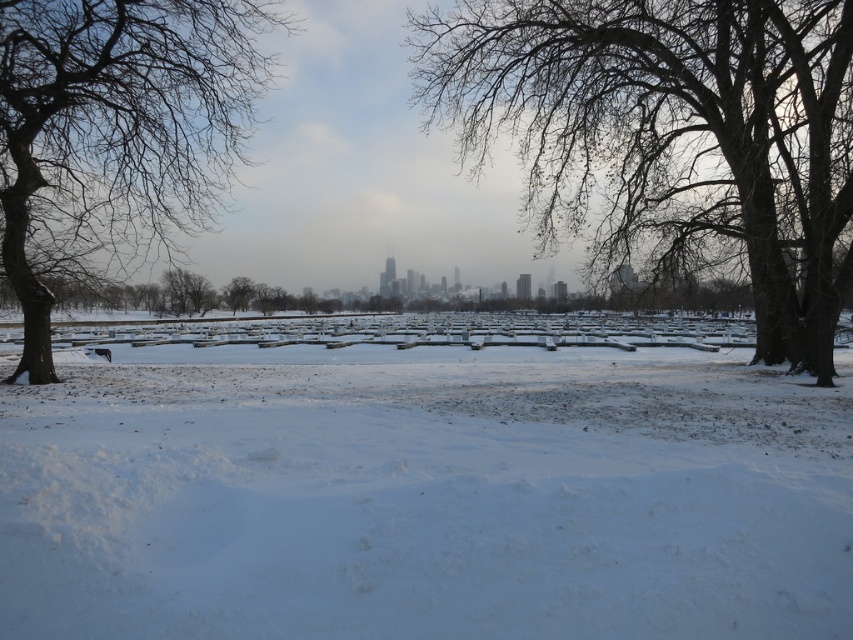
Which is above, bare wood tree at left or bare branches at center?

bare wood tree at left

Is bare wood tree at left positioned behind bare branches at center?

No.

Identify the location of bare wood tree at left. point(114,132).

You are a GUI agent. You are given a task and a screenshot of the screen. Output one action in this format:
    pyautogui.click(x=<x>, y=<y>)
    Task: Click on the bare wood tree at left
    This screenshot has height=640, width=853.
    Given the screenshot: What is the action you would take?
    pyautogui.click(x=114, y=132)

Based on the photo, which is more to the right, white fluffy snow at center or bare wood tree at center?

From the viewer's perspective, bare wood tree at center appears more on the right side.

Does point (238, 612) lie in front of point (730, 173)?

That is True.

What do you see at coordinates (422, 492) in the screenshot? I see `white fluffy snow at center` at bounding box center [422, 492].

Locate an element on the screen. white fluffy snow at center is located at coordinates (422, 492).

Which of these two, white fluffy snow at center or bare branches at center, stands shorter?

Standing shorter between the two is white fluffy snow at center.

Which is above, white fluffy snow at center or bare branches at center?

Positioned higher is bare branches at center.

What do you see at coordinates (422, 492) in the screenshot? I see `white fluffy snow at center` at bounding box center [422, 492].

Locate an element on the screen. Image resolution: width=853 pixels, height=640 pixels. white fluffy snow at center is located at coordinates (422, 492).